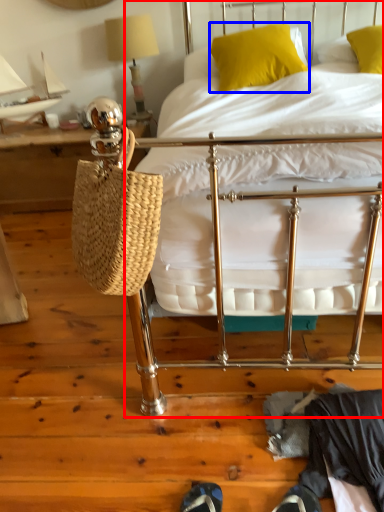
Question: Which of the following is the farthest to the observer, bed (highlighted by a red box) or pillow (highlighted by a blue box)?

Choices:
 (A) bed
 (B) pillow

Answer: (B)